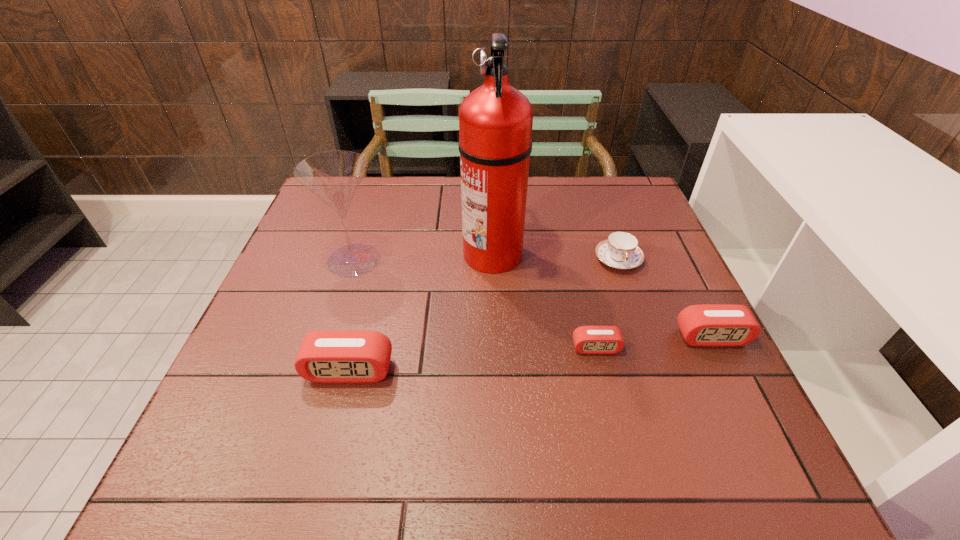
To achieve uniform spacing by inserting another alarm_clock among them, please point to a free space for this new alarm_clock. Please provide its 2D coordinates. Your answer should be formatted as a tuple, i.e. [(x, y)], where the tuple contains the x and y coordinates of a point satisfying the conditions above.

[(475, 359)]